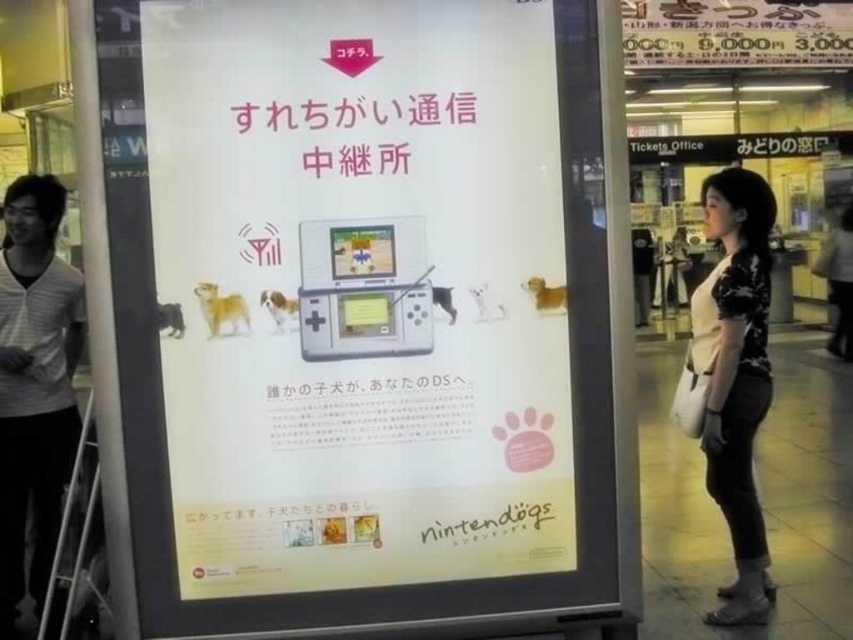
Looking at this image, you are standing in a public space and see the white paper poster at center and the gray striped shirt at left. Which object is nearer to you?

The white paper poster at center is closer to the viewer than the gray striped shirt at left.

You are a customer in a clothing store and see two shirts displayed on mannequins. The gray striped shirt at left and the black floral shirt at center. Which shirt is taller on its mannequin?

The gray striped shirt at left is much taller as the black floral shirt at center.

You are standing in front of the advertisement poster. There is a point marked at coordinates (33,385). What object is located at this point?

The point at coordinates (33,385) corresponds to the gray striped shirt at left.